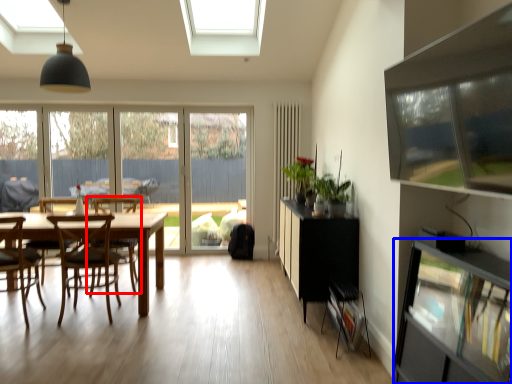
Question: Which of the following is the farthest to the observer, chair (highlighted by a red box) or shelf (highlighted by a blue box)?

Choices:
 (A) chair
 (B) shelf

Answer: (A)